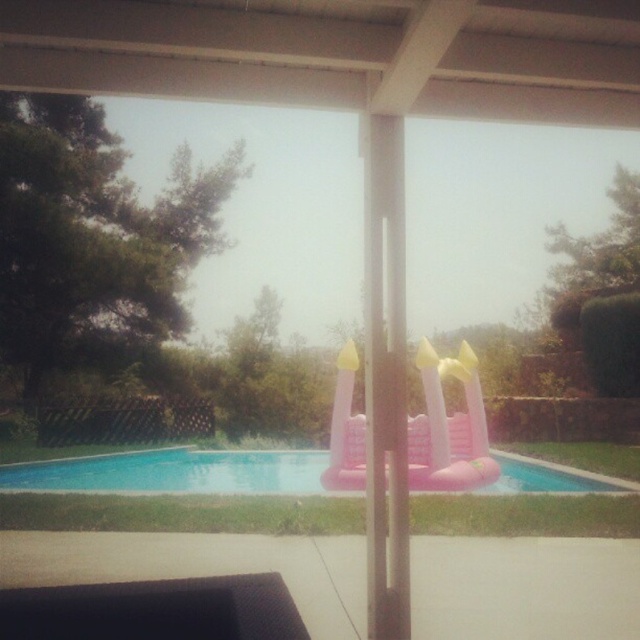
Question: Does pink inflatable castle at center appear on the right side of pink inflatable slide at center?

Choices:
 (A) no
 (B) yes

Answer: (A)

Question: Among these points, which one is farthest from the camera?

Choices:
 (A) click(x=451, y=420)
 (B) click(x=499, y=460)

Answer: (B)

Question: Among these points, which one is farthest from the camera?

Choices:
 (A) (336, 460)
 (B) (16, 480)

Answer: (B)

Question: Which of the following is the closest to the observer?

Choices:
 (A) (214, 476)
 (B) (435, 440)

Answer: (B)

Question: Where is pink inflatable castle at center located in relation to pink inflatable slide at center in the image?

Choices:
 (A) below
 (B) above

Answer: (A)

Question: Does pink inflatable castle at center appear on the left side of pink inflatable slide at center?

Choices:
 (A) no
 (B) yes

Answer: (B)